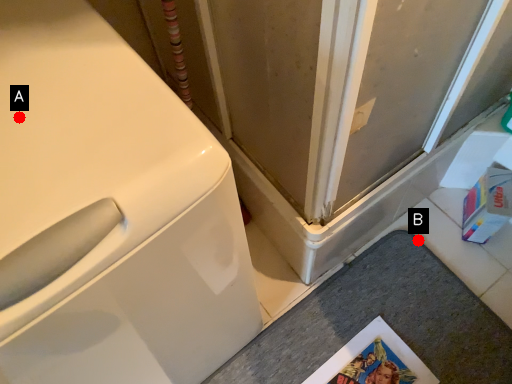
Question: Two points are circled on the image, labeled by A and B beside each circle. Which point is farther from the camera taking this photo?

Choices:
 (A) A is further
 (B) B is further

Answer: (B)